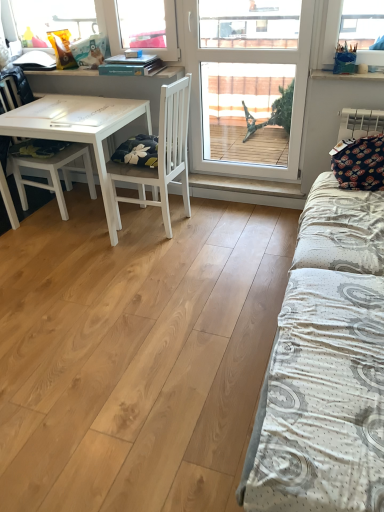
Question: From the image's perspective, is white textured bed at right above white matte table at left?

Choices:
 (A) yes
 (B) no

Answer: (B)

Question: Considering the relative sizes of white textured bed at right and white matte table at left in the image provided, is white textured bed at right taller than white matte table at left?

Choices:
 (A) no
 (B) yes

Answer: (B)

Question: Is the depth of white textured bed at right greater than that of white matte table at left?

Choices:
 (A) yes
 (B) no

Answer: (B)

Question: Is white textured bed at right shorter than white matte table at left?

Choices:
 (A) no
 (B) yes

Answer: (A)

Question: From the image's perspective, is white textured bed at right located beneath white matte table at left?

Choices:
 (A) no
 (B) yes

Answer: (B)

Question: Does point (3, 170) appear closer or farther from the camera than point (352, 78)?

Choices:
 (A) closer
 (B) farther

Answer: (B)

Question: Based on their sizes in the image, would you say white matte chair at left, the 2th chair viewed from the right, is bigger or smaller than white plastic bag at upper right?

Choices:
 (A) small
 (B) big

Answer: (B)

Question: In terms of width, does white matte chair at left, which is counted as the 1th chair, starting from the left, look wider or thinner when compared to white plastic bag at upper right?

Choices:
 (A) thin
 (B) wide

Answer: (B)

Question: From the image's perspective, is white matte chair at left, which is counted as the 1th chair, starting from the left, above or below white plastic bag at upper right?

Choices:
 (A) above
 (B) below

Answer: (B)

Question: Considering the positions of white textured bed at right and white plastic bag at upper right in the image, is white textured bed at right wider or thinner than white plastic bag at upper right?

Choices:
 (A) wide
 (B) thin

Answer: (A)

Question: Is point (377, 382) positioned closer to the camera than point (347, 73)?

Choices:
 (A) closer
 (B) farther

Answer: (A)

Question: From the image's perspective, relative to white plastic bag at upper right, is white textured bed at right above or below?

Choices:
 (A) below
 (B) above

Answer: (A)

Question: Considering the positions of white textured bed at right and white plastic bag at upper right in the image, is white textured bed at right taller or shorter than white plastic bag at upper right?

Choices:
 (A) short
 (B) tall

Answer: (B)

Question: Is transparent glass window at center wider or thinner than white plastic bag at upper right?

Choices:
 (A) wide
 (B) thin

Answer: (B)

Question: In the image, is transparent glass window at center positioned in front of or behind white plastic bag at upper right?

Choices:
 (A) behind
 (B) front

Answer: (B)